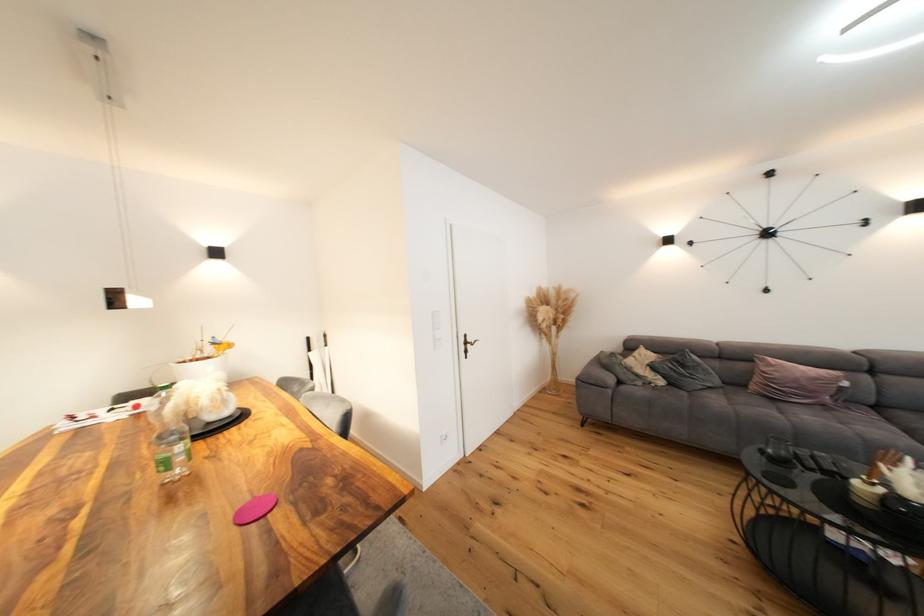
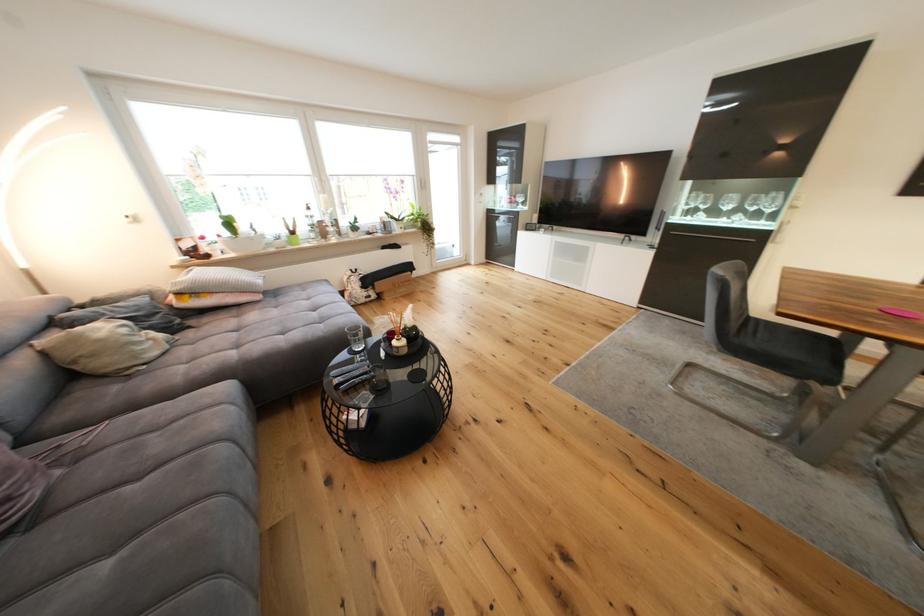
Find the pixel in the second image that matches [809,390] in the first image.

(18, 469)